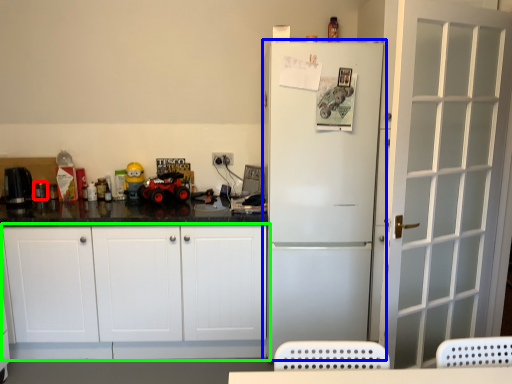
Question: Which object is positioned farthest from appliance (highlighted by a red box)? Select from refrigerator (highlighted by a blue box) and cabinetry (highlighted by a green box).

Choices:
 (A) refrigerator
 (B) cabinetry

Answer: (A)